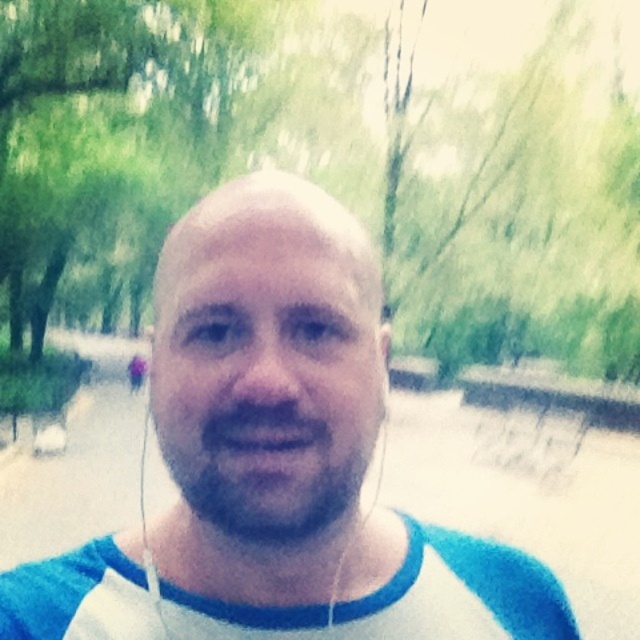
You are taking a selfie and want to ensure both the white fabric shirt at center and the beardsoftat center are clearly visible. Based on their positions, which one is closer to the camera?

The white fabric shirt at center is closer to the camera because it is in front of the beardsoftat center.

You are taking a selfie and want to ensure your white fabric shirt at center and beardsoftat center are both visible. Given that the camera has a limited focus range, which item might be more likely to be in focus if you focus on the closer one?

The white fabric shirt at center is closer to the camera than beardsoftat center, so focusing on the closer one would mean the white fabric shirt at center is more likely to be in focus.